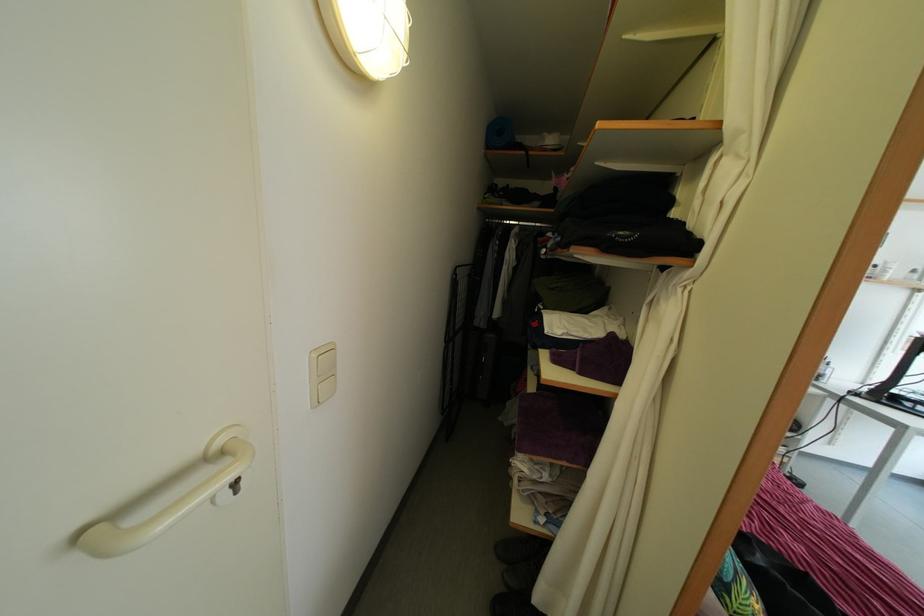
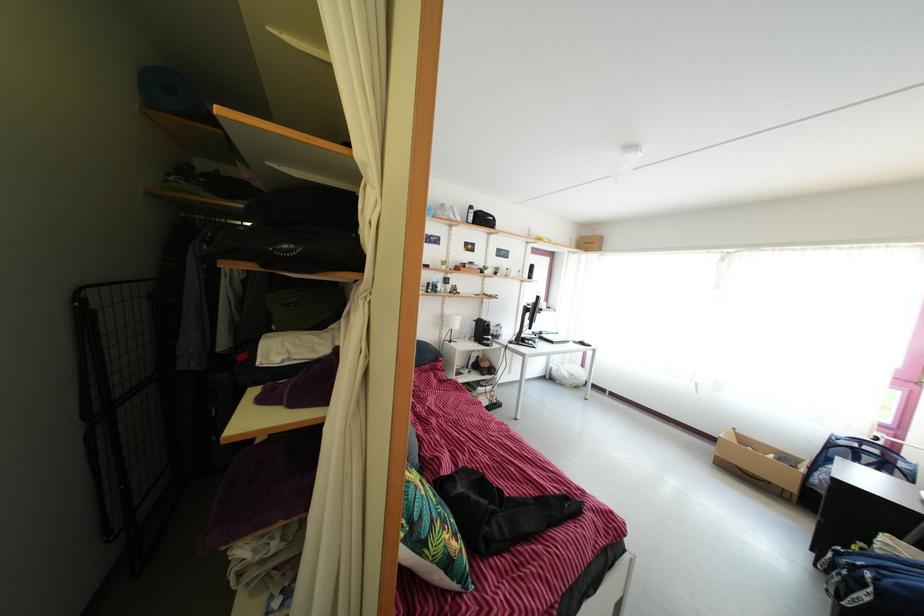
Question: Based on the continuous images, in which direction is the camera rotating? Reply with the corresponding letter.

Choices:
 (A) Left
 (B) Right
 (C) Up
 (D) Down

Answer: (B)